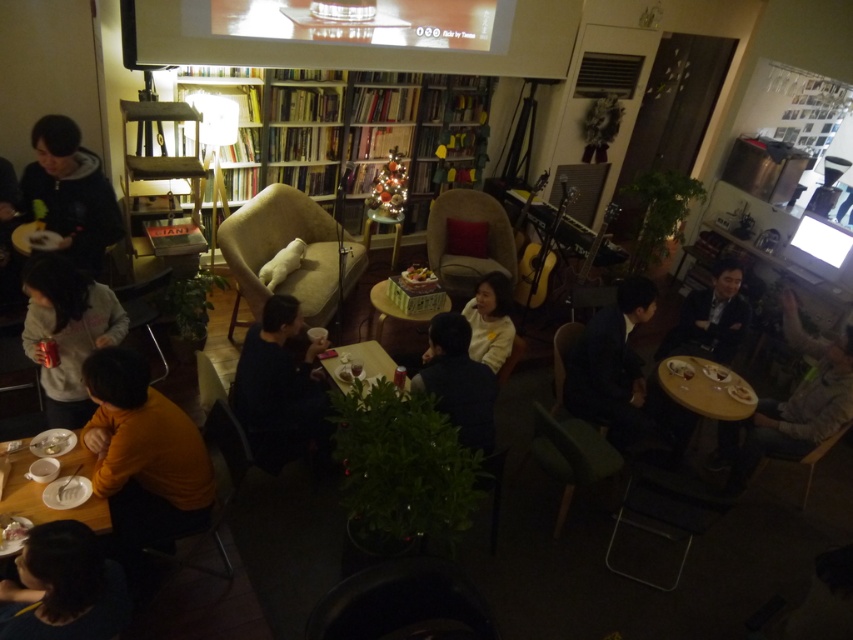
You are standing in the room and want to place a gift under the Christmas tree. You have a gray knit sweater at right and a yellow matte table at right. Which object is closer to the Christmas tree?

The gray knit sweater at right is closer to the Christmas tree because it is positioned to the right of the yellow matte table at right, which is also at the right side of the room. Since both are on the right, the sweater being to the right of the table would be nearer to the tree located near the right side.

You are a guest at this gathering and want to retrieve your dark blue sweater at lower center. The wooden bookshelf at center is blocking your path. Can you move around the bookshelf to get to your sweater?

The dark blue sweater at lower center is behind the wooden bookshelf at center, so you can move around the bookshelf to reach it since it is positioned behind the obstruction.

Looking at this image, you are standing in the room and want to reach both the point at coordinates [805,333] and the point at coordinates [721,417]. Which point will require you to walk further to reach?

The point at coordinates [721,417] will require you to walk further because it is closer to the camera than point [805,333]. Wait, but the description says the first point is further to the camera, so maybe I need to adjust. Hmm, the description says point A is further to the camera than point B. So in terms of distance from the observer, point A is closer? Wait, if a point is further to the camera, does that mean it is closer to the camera, hence closer to the observer? Let me think. If something is